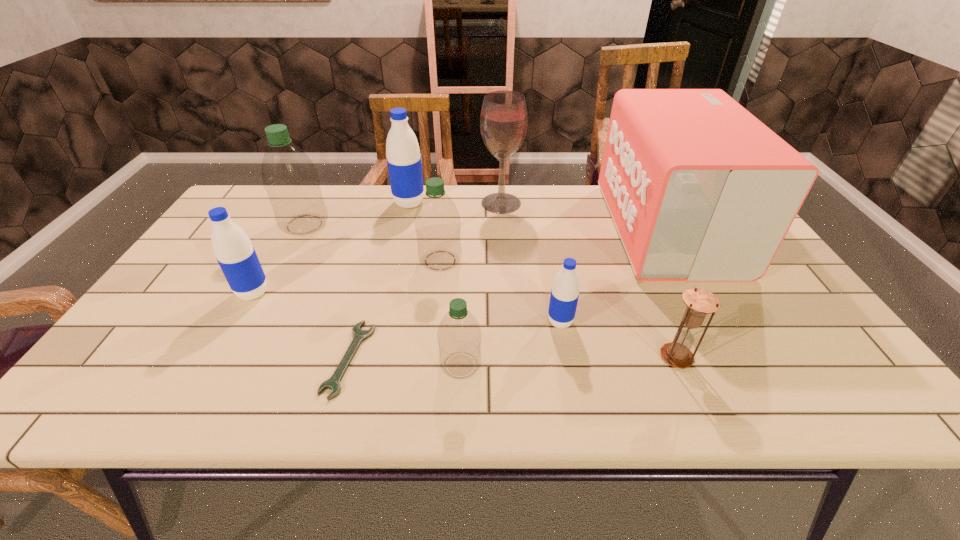
Locate which water bottle ranks third in proximity to the biggest green water bottle. Please provide its 2D coordinates. Your answer should be formatted as a tuple, i.e. [(x, y)], where the tuple contains the x and y coordinates of a point satisfying the conditions above.

[(437, 222)]

Find the location of a particular element. The height and width of the screenshot is (540, 960). water bottle that is the closest to the wrench is located at coordinates (459, 336).

Identify the location of blue water bottle that stands as the second closest to the third farthest water bottle. The height and width of the screenshot is (540, 960). (564, 296).

At what (x,y) coordinates should I click in order to perform the action: click on blue water bottle that is the closest one to the smallest green water bottle. Please return your answer as a coordinate pair (x, y). The image size is (960, 540). Looking at the image, I should click on (564, 296).

Find the location of a particular element. Image resolution: width=960 pixels, height=540 pixels. green water bottle that stands as the second closest to the second blue water bottle from left to right is located at coordinates (437, 222).

Identify the location of green water bottle that stands as the third closest to the shortest object. (290, 178).